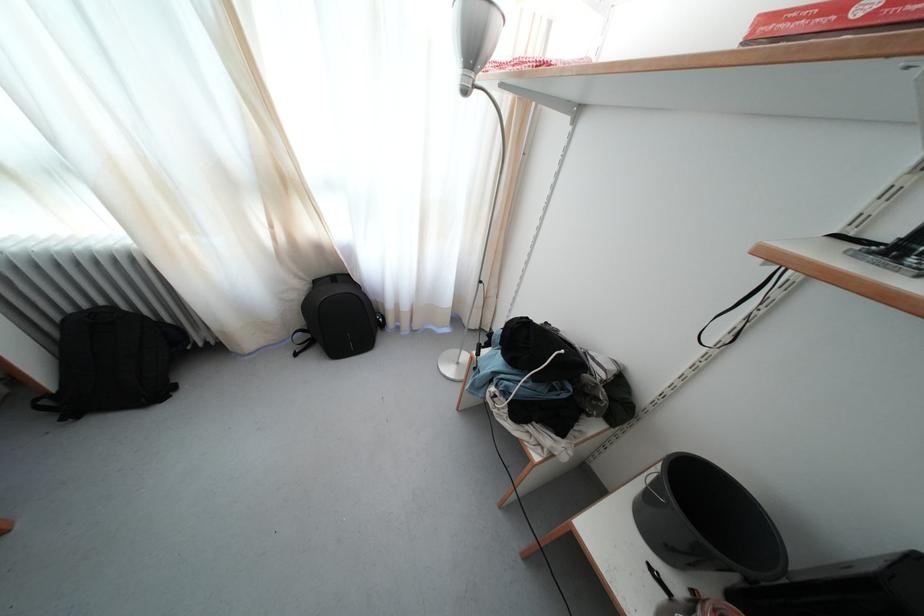
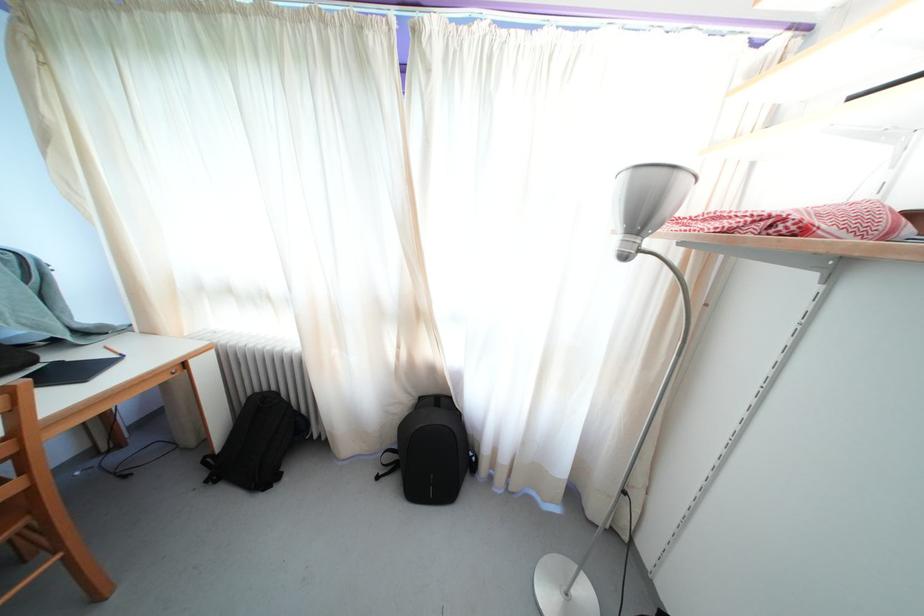
Find the pixel in the second image that matches pixel 480 59 in the first image.

(648, 223)